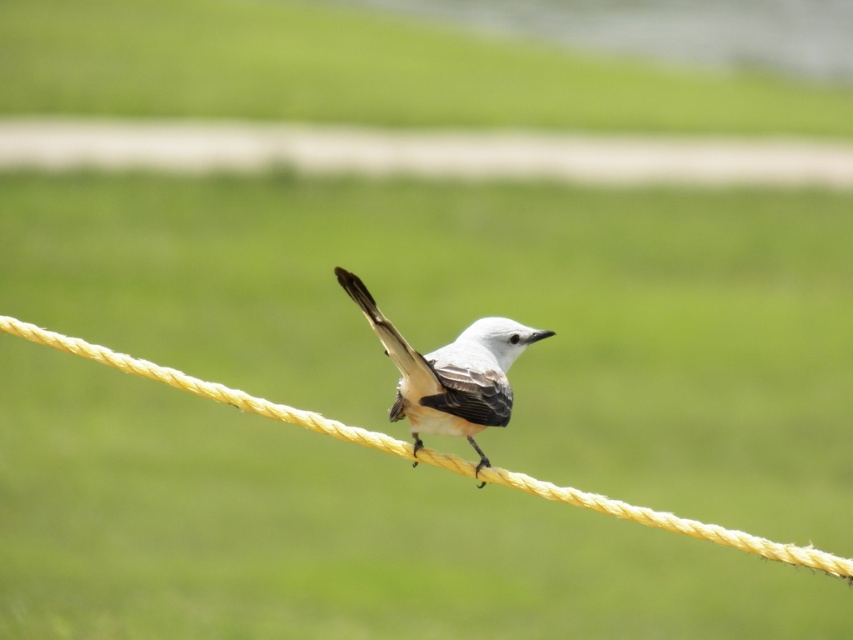
Who is lower down, yellow rope at center or white matte bird at center?

Positioned lower is yellow rope at center.

Who is more distant from viewer, [743,548] or [430,369]?

The point [430,369] is behind.

Is point (570, 499) farther from camera compared to point (451, 428)?

No, it is in front of (451, 428).

The image size is (853, 640). Identify the location of yellow rope at center. (206, 387).